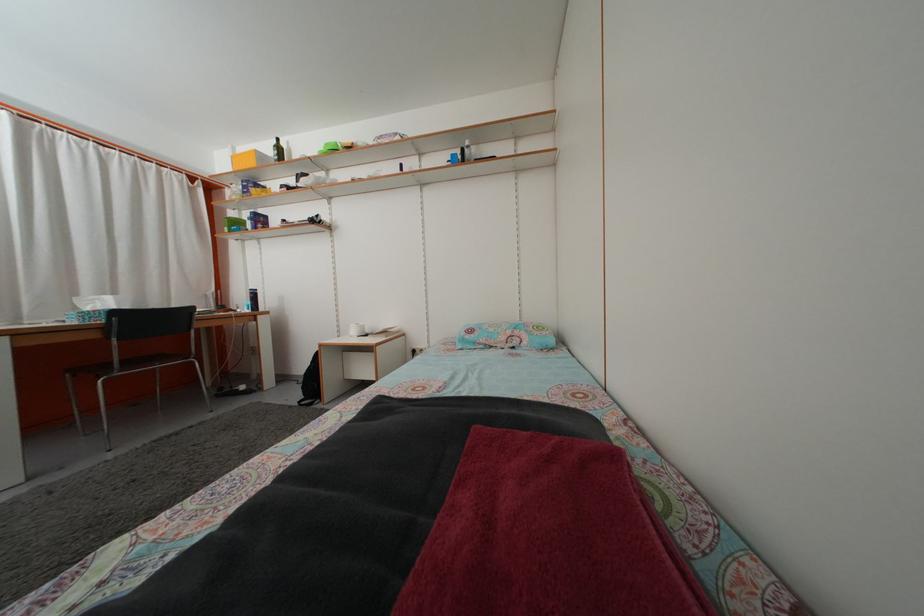
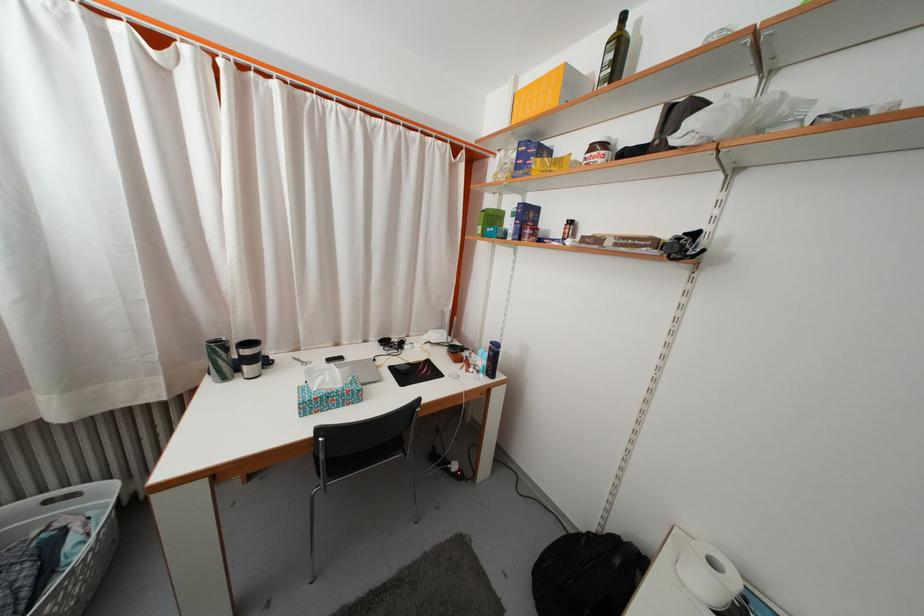
The point at [250,200] is marked in the first image. Where is the corresponding point in the second image?

(523, 175)